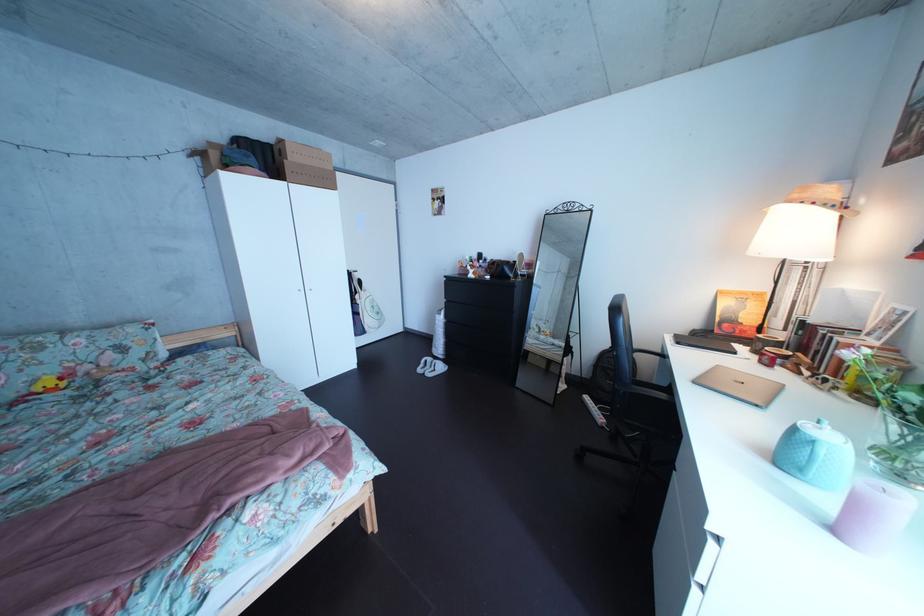
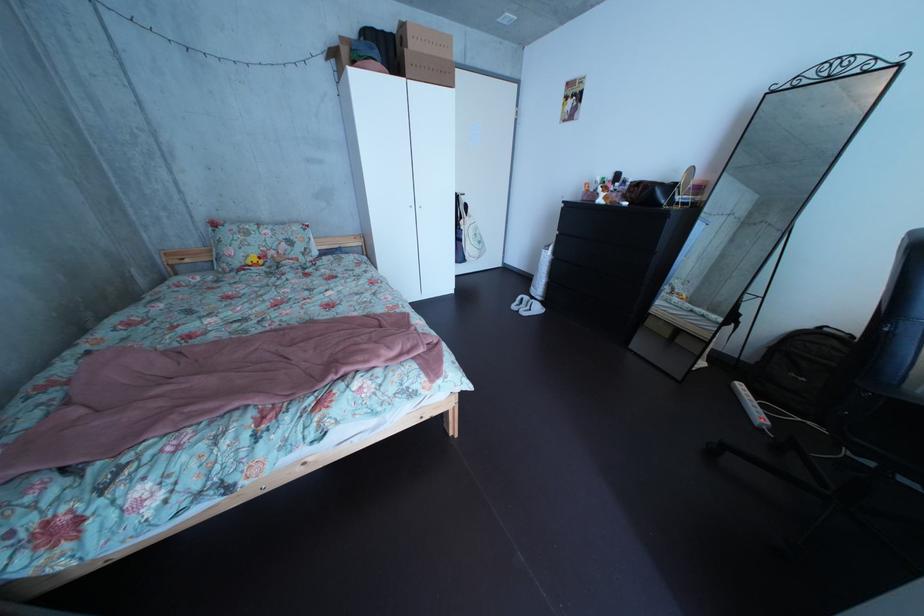
Locate, in the second image, the point that corresponds to pixel 293 177 in the first image.

(414, 73)